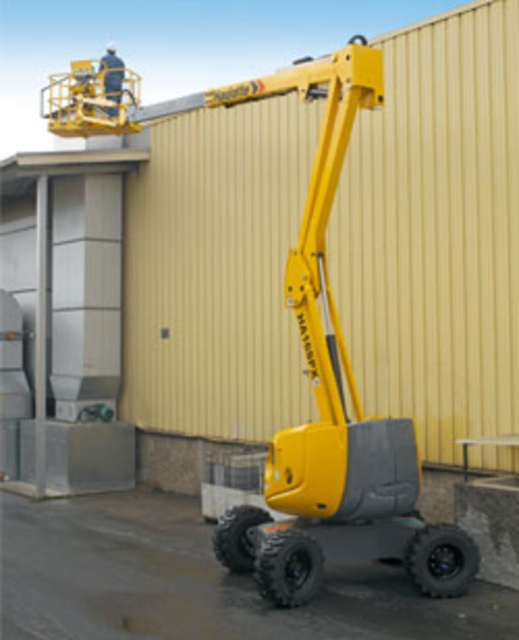
You are a safety inspector who needs to ensure the yellow matte forklift at center and the white fabric construction worker at upper center are positioned safely. Based on their widths, which object is wider?

The yellow matte forklift at center is wider than the white fabric construction worker at upper center according to the description.

You are standing in front of the yellow articulated boom lift and looking at the two points marked on the image. Which point, point (294, 547) or point (116, 100), is closer to you?

Point (294, 547) is closer to the camera than point (116, 100), so the point closer to you is point (294, 547).